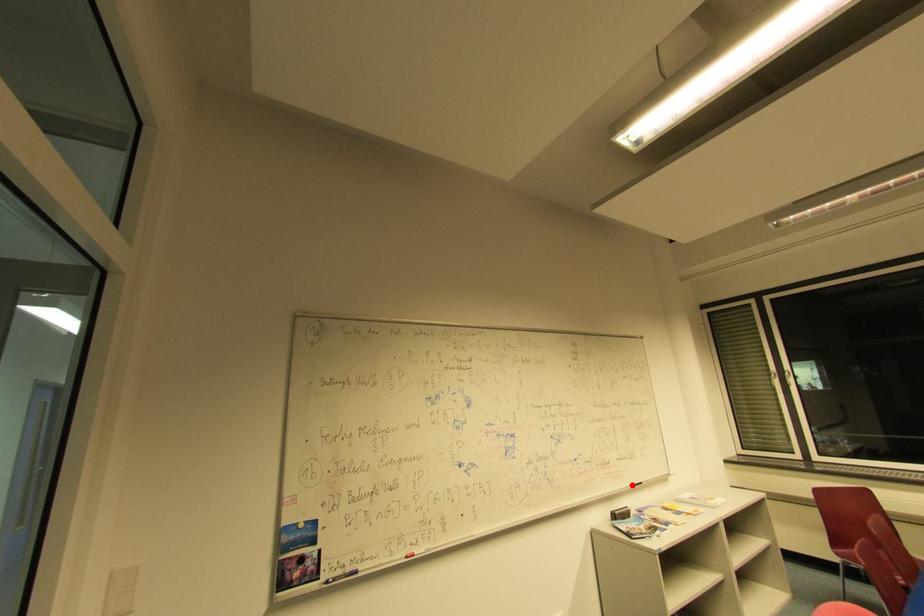
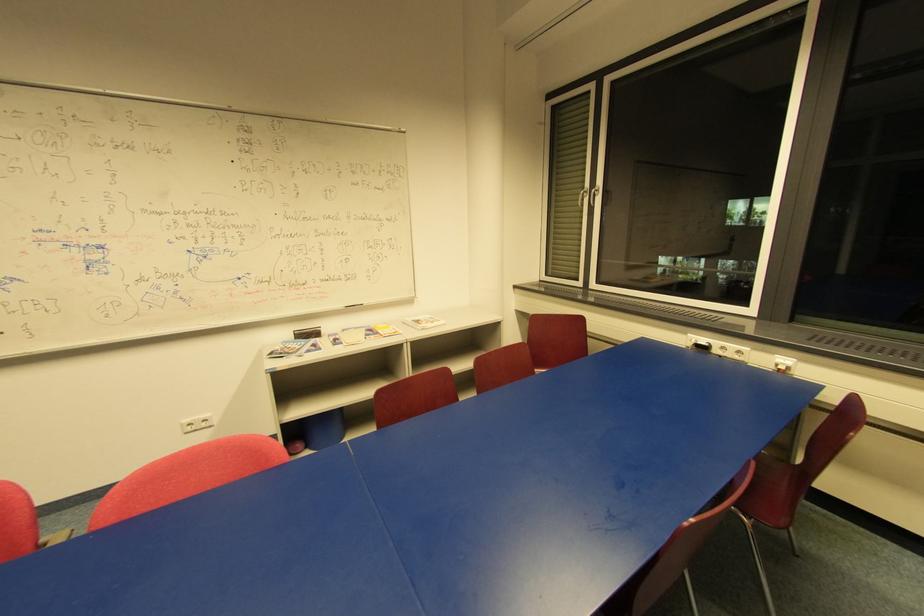
Locate, in the second image, the point that corresponds to the highlighted location in the first image.

(344, 307)